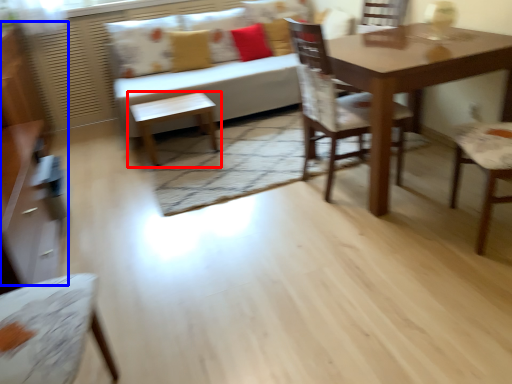
Question: Which of the following is the closest to the observer, table (highlighted by a red box) or dresser (highlighted by a blue box)?

Choices:
 (A) table
 (B) dresser

Answer: (B)